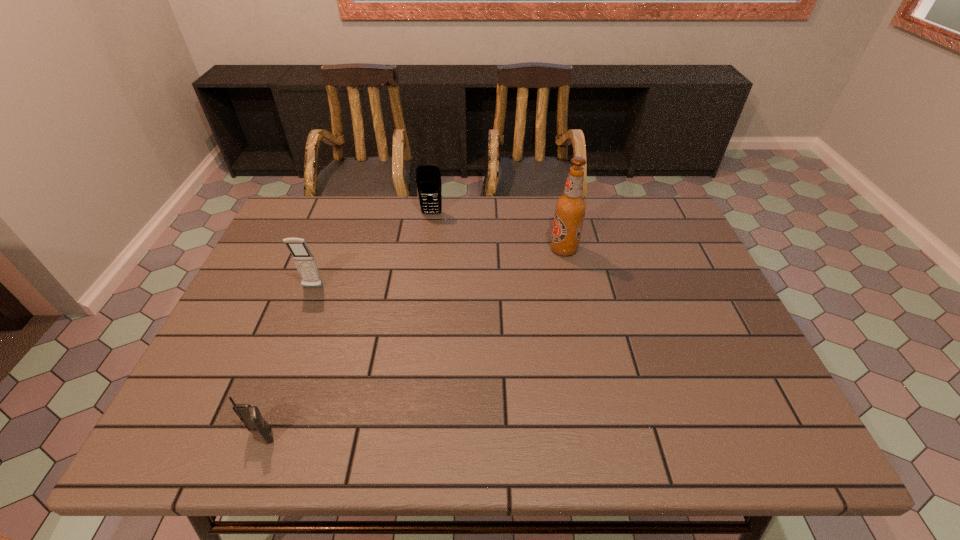
Where is `vacant point located between the second nearest object and the rightmost object`? vacant point located between the second nearest object and the rightmost object is located at coordinates (438, 268).

Choose which object is the nearest neighbor to the shortest object. Please provide its 2D coordinates. Your answer should be formatted as a tuple, i.e. [(x, y)], where the tuple contains the x and y coordinates of a point satisfying the conditions above.

[(304, 260)]

This screenshot has height=540, width=960. I want to click on object that can be found as the third closest to the third farthest object, so click(x=570, y=208).

Identify which cellular telephone is the third closest to the second farthest object. Please provide its 2D coordinates. Your answer should be formatted as a tuple, i.e. [(x, y)], where the tuple contains the x and y coordinates of a point satisfying the conditions above.

[(250, 415)]

Select which cellular telephone appears as the closest to the beer bottle. Please provide its 2D coordinates. Your answer should be formatted as a tuple, i.e. [(x, y)], where the tuple contains the x and y coordinates of a point satisfying the conditions above.

[(428, 178)]

The image size is (960, 540). What are the coordinates of `vacant position in the image that satisfies the following two spatial constraints: 1. on the front label of the third nearest object; 2. on the keyboard of the shortest object` in the screenshot? It's located at (603, 436).

This screenshot has width=960, height=540. What are the coordinates of `vacant area that satisfies the following two spatial constraints: 1. on the front label of the third nearest object; 2. on the keyboard of the shortest object` in the screenshot? It's located at (603, 436).